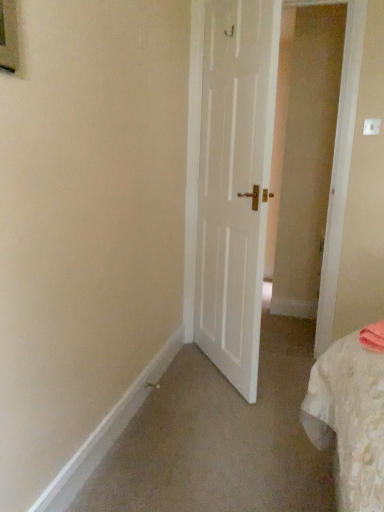
The image size is (384, 512). In order to click on vacant space in front of white matte door at center in this screenshot , I will do `click(228, 424)`.